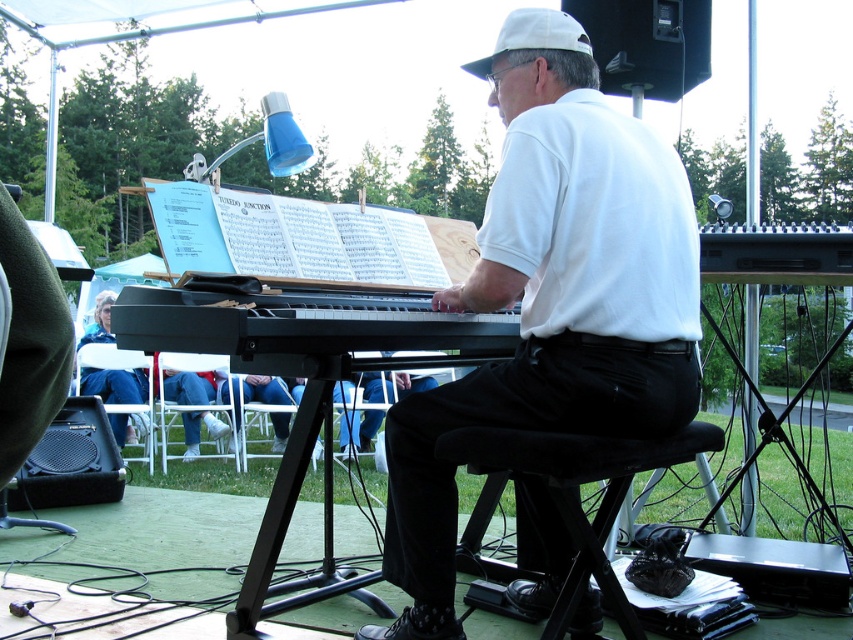
You are a spectator sitting in the front row, directly facing the black matte keyboard at center and the black fabric stool at lower center. Which object is closer to you?

The black matte keyboard at center is closer to you because it is positioned further to the viewer than the black fabric stool at lower center.

You are a photographer taking a picture of the scene. You need to ensure that both the white matte shirt at center and the black matte keyboard at center are clearly visible. Given their sizes, which object might require you to adjust your camera focus more carefully to avoid blurriness?

The white matte shirt at center is thinner than the black matte keyboard at center, so the white matte shirt at center might require more careful focus adjustment due to its smaller size to ensure clarity.